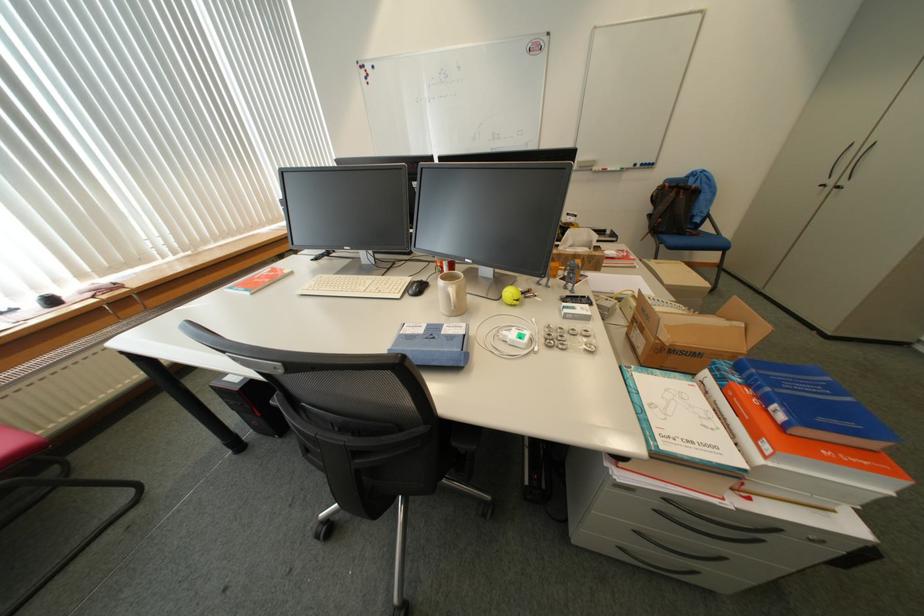
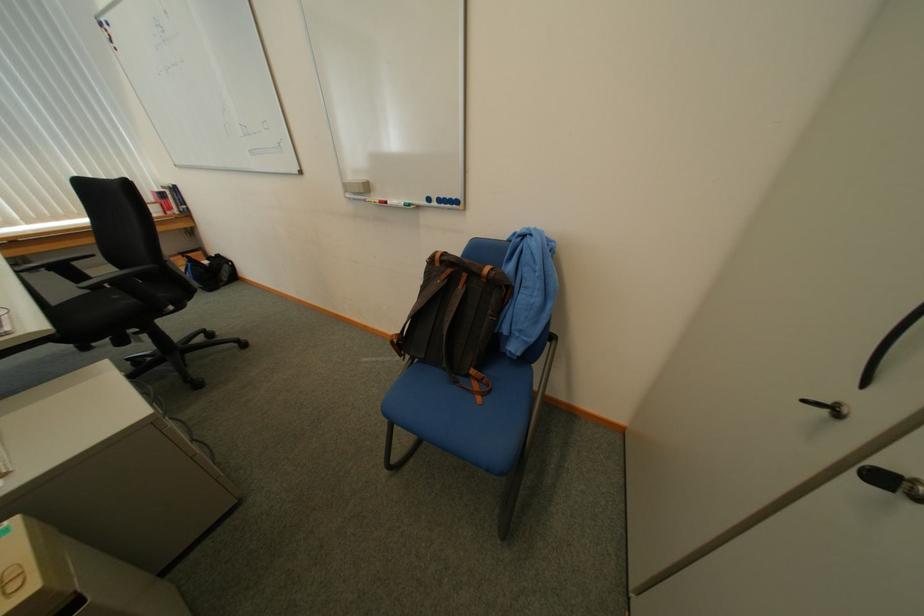
The point at (614, 171) is marked in the first image. Where is the corresponding point in the second image?

(396, 204)